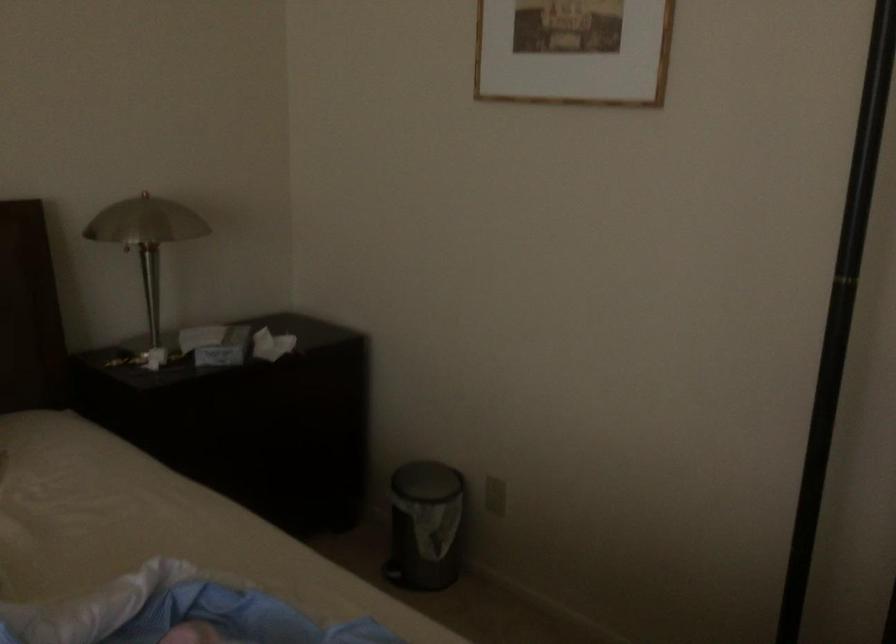
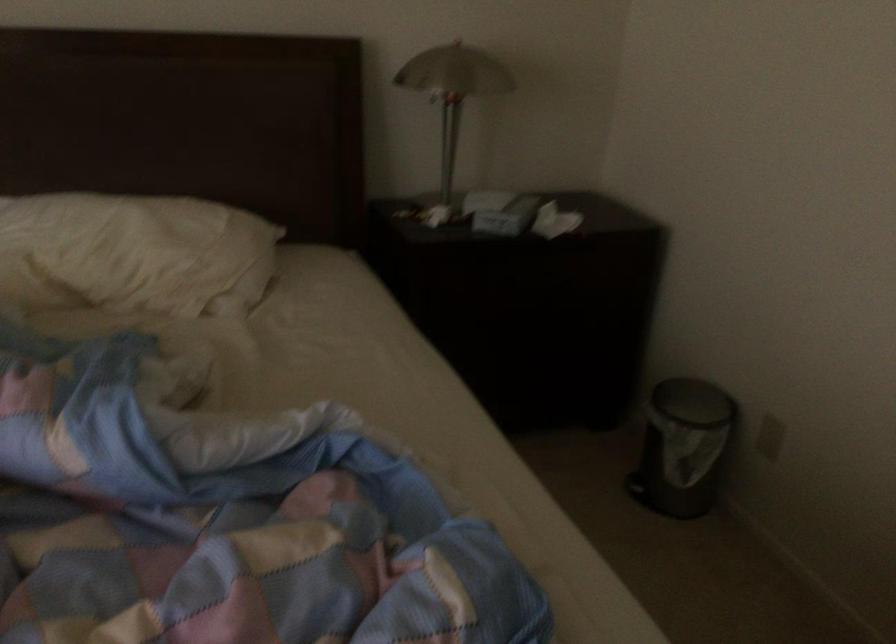
Find the pixel in the second image that matches pixel 152 236 in the first image.

(453, 91)